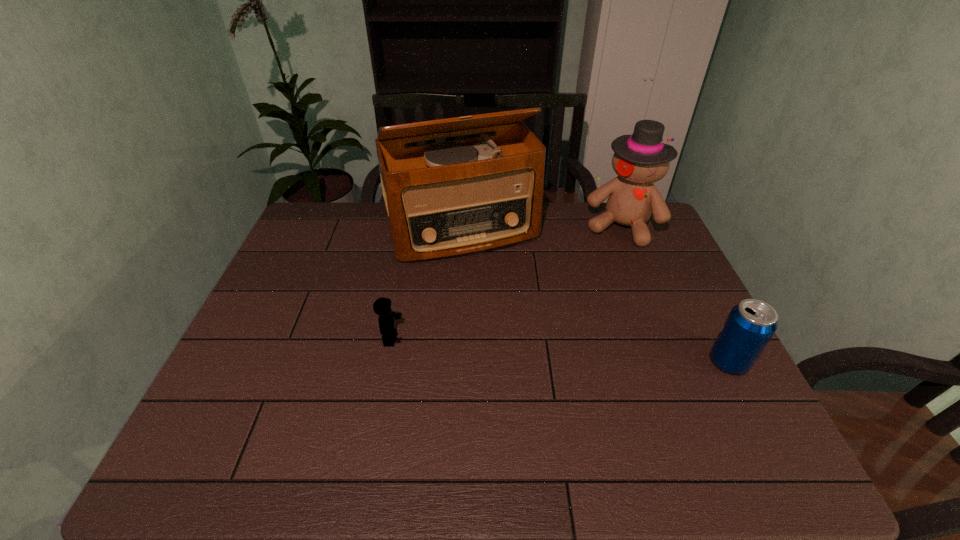
Where is `vacant space on the desktop that is between the shortest object and the second shortest object and is positioned on the front-facing side of the third shortest object`? vacant space on the desktop that is between the shortest object and the second shortest object and is positioned on the front-facing side of the third shortest object is located at coordinates (573, 351).

This screenshot has height=540, width=960. I want to click on free space on the desktop that is between the Lego and the second shortest object and is positioned on the front panel of the radio receiver, so click(515, 347).